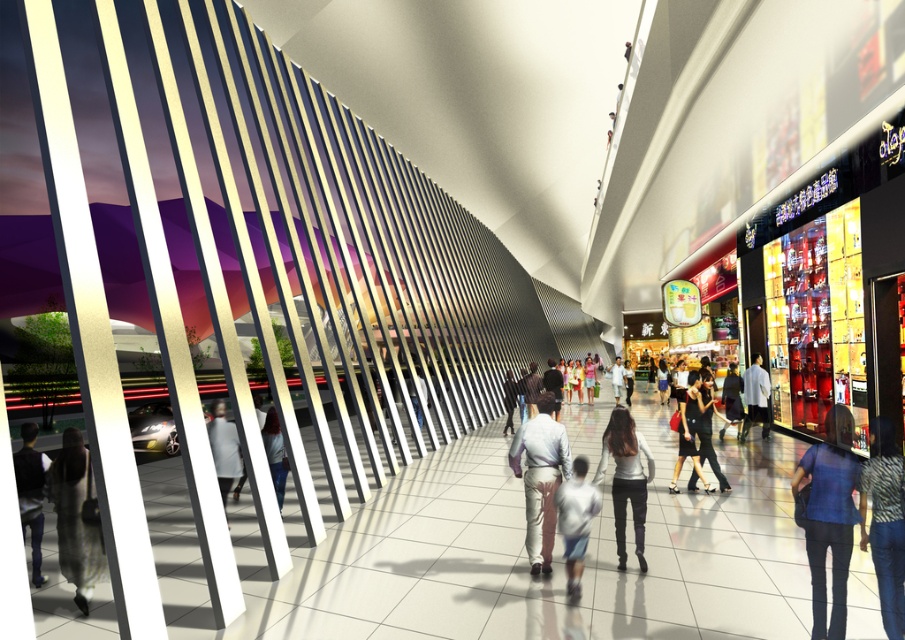
Question: Can you confirm if light beige pants at center is smaller than dark gray pants at lower left?

Choices:
 (A) no
 (B) yes

Answer: (B)

Question: Among these points, which one is farthest from the camera?

Choices:
 (A) (515, 392)
 (B) (693, 401)
 (C) (759, 413)
 (D) (624, 474)

Answer: (A)

Question: Is light beige pants at center smaller than denim pants at center?

Choices:
 (A) yes
 (B) no

Answer: (A)

Question: Which point is closer to the camera?

Choices:
 (A) white matte coat at center
 (B) light gray fabric coat at center
 (C) blue denim jeans at lower right
 (D) dark gray pants at lower left

Answer: (C)

Question: Which point appears closest to the camera in this image?

Choices:
 (A) (707, 486)
 (B) (580, 561)
 (C) (513, 387)

Answer: (B)

Question: In this image, where is light beige pants at center located relative to dark gray pants at lower left?

Choices:
 (A) right
 (B) left

Answer: (A)